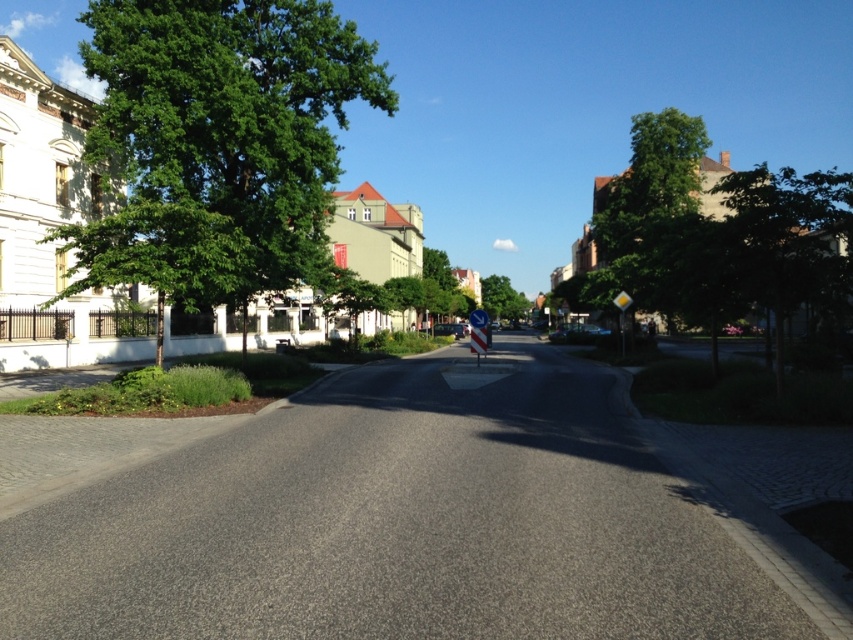
Is the position of green leafy tree at left less distant than that of green leafy tree at center?

Yes, green leafy tree at left is in front of green leafy tree at center.

Is green leafy tree at left bigger than green leafy tree at center?

No.

This screenshot has width=853, height=640. In order to click on green leafy tree at left in this screenshot , I will do `click(218, 141)`.

Where is `green leafy tree at left`? This screenshot has width=853, height=640. green leafy tree at left is located at coordinates (218, 141).